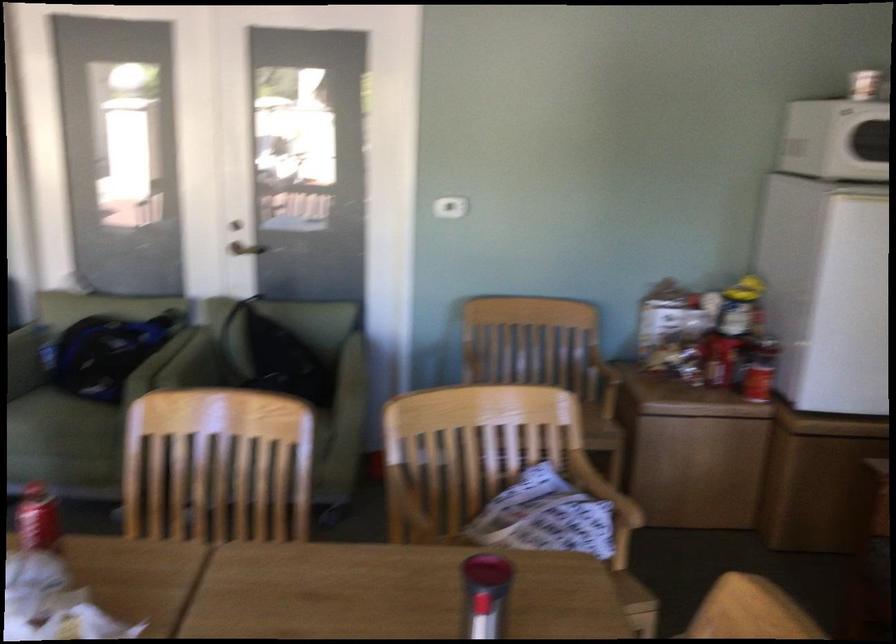
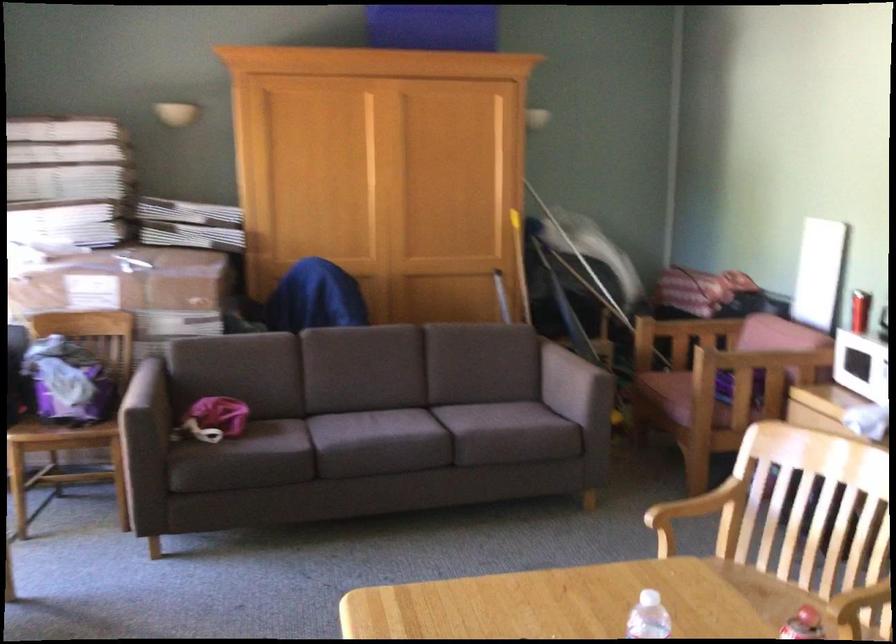
Question: Based on the continuous images, in which direction is the camera rotating? Reply with the corresponding letter.

Choices:
 (A) Left
 (B) Right
 (C) Up
 (D) Down

Answer: (A)